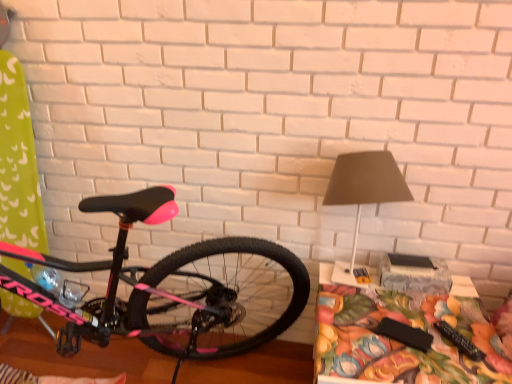
Locate an element on the screen. This screenshot has height=384, width=512. floral fabric table at lower right is located at coordinates (400, 342).

The height and width of the screenshot is (384, 512). Find the location of `pink matte bicycle at left`. pink matte bicycle at left is located at coordinates (175, 288).

How different are the orientations of matte gray lampshade at upper right and pink matte bicycle at left in degrees?

matte gray lampshade at upper right and pink matte bicycle at left are facing 91 degrees away from each other.

From the image's perspective, is matte gray lampshade at upper right under pink matte bicycle at left?

Actually, matte gray lampshade at upper right appears above pink matte bicycle at left in the image.

From a real-world perspective, does matte gray lampshade at upper right stand above pink matte bicycle at left?

Yes, from a real-world perspective, matte gray lampshade at upper right is over pink matte bicycle at left

Is matte gray lampshade at upper right taller or shorter than pink matte bicycle at left?

In the image, matte gray lampshade at upper right appears to be shorter than pink matte bicycle at left.

Is floral fabric table at lower right turned away from matte gray lampshade at upper right?

floral fabric table at lower right does not have its back to matte gray lampshade at upper right.

Which object is wider, floral fabric table at lower right or matte gray lampshade at upper right?

floral fabric table at lower right.

Based on the photo, is there a large distance between floral fabric table at lower right and matte gray lampshade at upper right?

No, floral fabric table at lower right is in close proximity to matte gray lampshade at upper right.

Considering the sizes of objects floral fabric table at lower right and matte gray lampshade at upper right in the image provided, who is shorter, floral fabric table at lower right or matte gray lampshade at upper right?

floral fabric table at lower right is shorter.

Is pink matte bicycle at left shorter than floral fabric table at lower right?

No.

Does pink matte bicycle at left appear on the right side of floral fabric table at lower right?

No, pink matte bicycle at left is not to the right of floral fabric table at lower right.

Consider the image. Is pink matte bicycle at left in front of or behind floral fabric table at lower right in the image?

In the image, pink matte bicycle at left appears in front of floral fabric table at lower right.

From the image's perspective, which is above, pink matte bicycle at left or floral fabric table at lower right?

pink matte bicycle at left appears higher in the image.

Considering the points (328, 294) and (193, 297), which point is behind, point (328, 294) or point (193, 297)?

The point (193, 297) is more distant.

Is floral fabric table at lower right further to the viewer compared to pink matte bicycle at left?

That is True.

Does floral fabric table at lower right have a lesser height compared to pink matte bicycle at left?

Yes, floral fabric table at lower right is shorter than pink matte bicycle at left.

Can you confirm if pink matte bicycle at left is positioned to the right of matte gray lampshade at upper right?

No, pink matte bicycle at left is not to the right of matte gray lampshade at upper right.

From the image's perspective, which is below, pink matte bicycle at left or matte gray lampshade at upper right?

From the image's view, pink matte bicycle at left is below.

Which object is further away from the camera taking this photo, pink matte bicycle at left or matte gray lampshade at upper right?

matte gray lampshade at upper right is further away from the camera.

Can you confirm if matte gray lampshade at upper right is positioned to the left of floral fabric table at lower right?

Correct, you'll find matte gray lampshade at upper right to the left of floral fabric table at lower right.

From a real-world perspective, between matte gray lampshade at upper right and floral fabric table at lower right, who is vertically lower?

In real-world perspective, floral fabric table at lower right is lower.

Where is `table lamp behind the floral fabric table at lower right`? table lamp behind the floral fabric table at lower right is located at coordinates (365, 184).

From the picture: Is matte gray lampshade at upper right further to the viewer compared to floral fabric table at lower right?

Yes, it is behind floral fabric table at lower right.

Where is `bicycle in front of the matte gray lampshade at upper right`? bicycle in front of the matte gray lampshade at upper right is located at coordinates (175, 288).

The height and width of the screenshot is (384, 512). In order to click on table lamp to the left of floral fabric table at lower right in this screenshot , I will do `click(365, 184)`.

Considering their positions, is matte gray lampshade at upper right positioned closer to pink matte bicycle at left than floral fabric table at lower right?

floral fabric table at lower right is positioned closer to the anchor pink matte bicycle at left.

Based on their spatial positions, is floral fabric table at lower right or pink matte bicycle at left closer to matte gray lampshade at upper right?

Based on the image, floral fabric table at lower right appears to be nearer to matte gray lampshade at upper right.

When comparing their distances from floral fabric table at lower right, does pink matte bicycle at left or matte gray lampshade at upper right seem closer?

matte gray lampshade at upper right is positioned closer to the anchor floral fabric table at lower right.

Based on the photo, from the image, which object appears to be farther from matte gray lampshade at upper right, pink matte bicycle at left or floral fabric table at lower right?

The object further to matte gray lampshade at upper right is pink matte bicycle at left.

When comparing their distances from floral fabric table at lower right, does matte gray lampshade at upper right or pink matte bicycle at left seem further?

pink matte bicycle at left is further to floral fabric table at lower right.

Estimate the real-world distances between objects in this image. Which object is closer to pink matte bicycle at left, floral fabric table at lower right or matte gray lampshade at upper right?

floral fabric table at lower right is positioned closer to the anchor pink matte bicycle at left.

You are a GUI agent. You are given a task and a screenshot of the screen. Output one action in this format:
    pyautogui.click(x=<x>, y=<y>)
    Task: Click on the table lamp between pink matte bicycle at left and floral fabric table at lower right
    This screenshot has width=512, height=384.
    Given the screenshot: What is the action you would take?
    pyautogui.click(x=365, y=184)